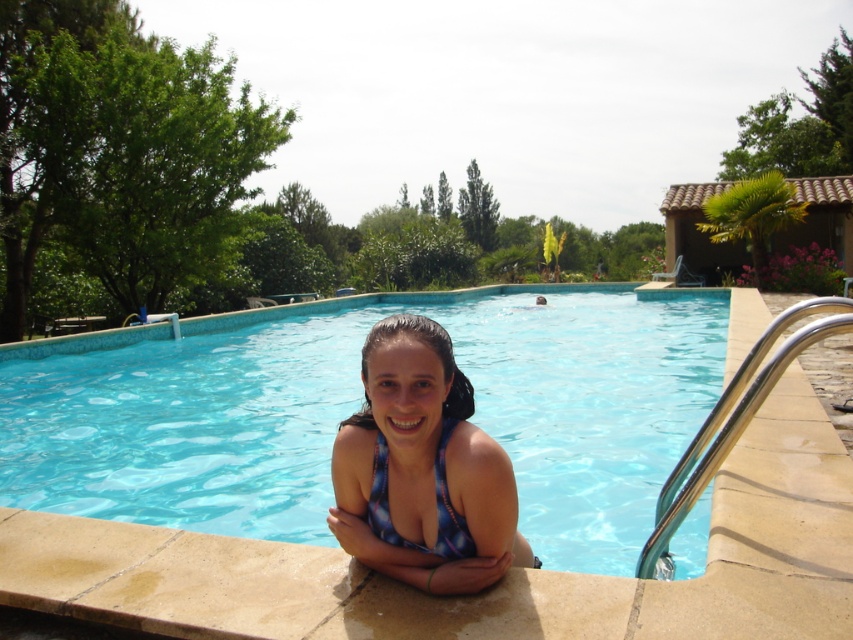
Question: Can you confirm if blue printed swimsuit at center is bigger than blue printed bikini top at center?

Choices:
 (A) no
 (B) yes

Answer: (B)

Question: Which object is positioned farthest from the beige stone ledge at lower center?

Choices:
 (A) blue glossy pool at center
 (B) blue printed swimsuit at center
 (C) blue printed bikini top at center

Answer: (A)

Question: Which of these objects is positioned farthest from the blue printed swimsuit at center?

Choices:
 (A) beige stone ledge at lower center
 (B) blue glossy pool at center
 (C) blue printed bikini top at center

Answer: (B)

Question: Which point appears closest to the camera in this image?

Choices:
 (A) [x=415, y=515]
 (B) [x=630, y=292]
 (C) [x=387, y=538]

Answer: (A)

Question: Is blue glossy pool at center thinner than blue printed bikini top at center?

Choices:
 (A) yes
 (B) no

Answer: (B)

Question: Is blue glossy pool at center wider than blue printed bikini top at center?

Choices:
 (A) no
 (B) yes

Answer: (B)